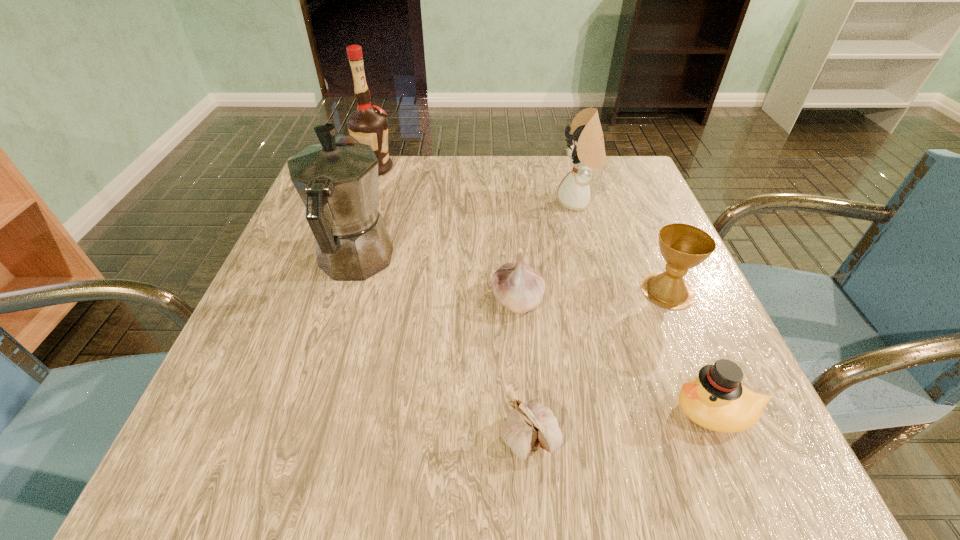
You are a GUI agent. You are given a task and a screenshot of the screen. Output one action in this format:
    pyautogui.click(x=<x>, y=<y>)
    Task: Click on the blank space located on the pouring side of the coffeepot
    The height and width of the screenshot is (540, 960).
    Given the screenshot: What is the action you would take?
    pyautogui.click(x=386, y=161)

Identify the location of vacant space positioned 0.300m on the pouring side of the coffeepot. The image size is (960, 540). (387, 156).

Locate an element on the screen. The width and height of the screenshot is (960, 540). vacant space situated 0.220m at the front face of the fifth shortest object is located at coordinates (461, 202).

You are a GUI agent. You are given a task and a screenshot of the screen. Output one action in this format:
    pyautogui.click(x=<x>, y=<y>)
    Task: Click on the free space located 0.380m at the front face of the fifth shortest object
    
    Given the screenshot: What is the action you would take?
    pyautogui.click(x=392, y=202)

Identify the location of vacant space situated at the front face of the fifth shortest object. (431, 202).

Locate an element on the screen. This screenshot has width=960, height=540. vacant space located on the front of the chalice is located at coordinates (745, 471).

At what (x,y) coordinates should I click in order to perform the action: click on free point located 0.290m on the right of the farther garlic. Please return your answer as a coordinate pair (x, y). Looking at the image, I should click on (705, 300).

Find the location of a particular element. The image size is (960, 540). vacant space located on the front-facing side of the duck is located at coordinates (406, 412).

Locate an element on the screen. Image resolution: width=960 pixels, height=540 pixels. vacant space situated on the front-facing side of the duck is located at coordinates (483, 412).

At what (x,y) coordinates should I click in order to perform the action: click on vacant area located 0.270m on the front-facing side of the duck. Please return your answer as a coordinate pair (x, y). Looking at the image, I should click on (483, 412).